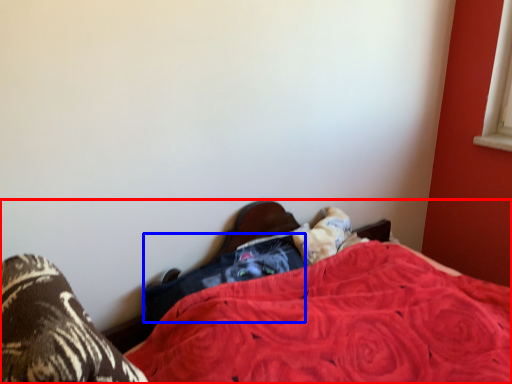
Question: Which of the following is the farthest to the observer, bed (highlighted by a red box) or clothing (highlighted by a blue box)?

Choices:
 (A) bed
 (B) clothing

Answer: (B)